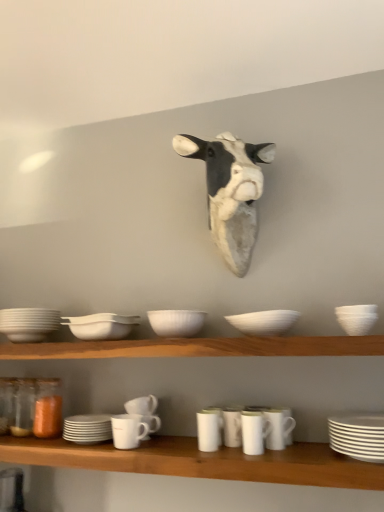
In order to click on free location to the right of white matte mug at lower center, which is counted as the third tableware, starting from the left in this screenshot , I will do `click(166, 449)`.